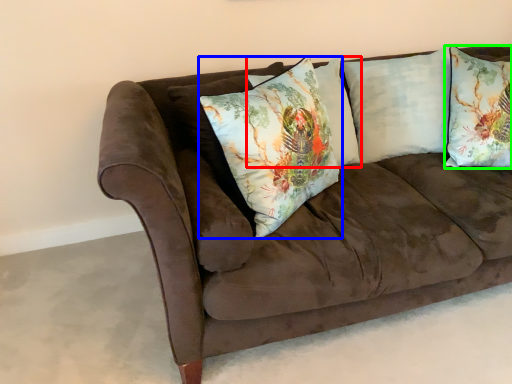
Question: Based on their relative distances, which object is nearer to pillow (highlighted by a red box)? Choose from pillow (highlighted by a blue box) and pillow (highlighted by a green box).

Choices:
 (A) pillow
 (B) pillow

Answer: (A)